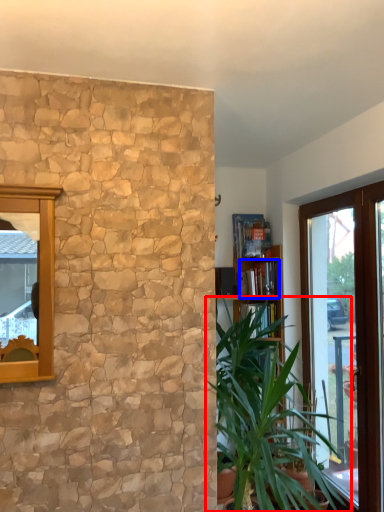
Question: Which object is further to the camera taking this photo, houseplant (highlighted by a red box) or book (highlighted by a blue box)?

Choices:
 (A) houseplant
 (B) book

Answer: (B)